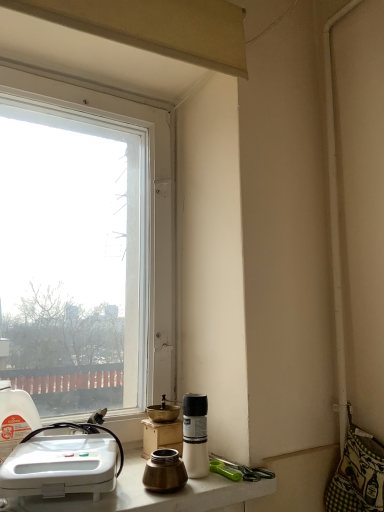
The height and width of the screenshot is (512, 384). What do you see at coordinates (162, 428) in the screenshot?
I see `gold matte grinder at center` at bounding box center [162, 428].

Locate an element on the screen. translucent plastic bottle at left, the 2th bottle from the right is located at coordinates (15, 417).

Find the location of a particular element. The image size is (384, 512). transparent glass window at upper left is located at coordinates (149, 202).

This screenshot has width=384, height=512. I want to click on white plastic sink at lower left, so click(62, 464).

Where is `gold matte grinder at center`? gold matte grinder at center is located at coordinates [162, 428].

There is a white glossy countertop at lower center. Where is `sink above it (from a real-world perspective)`? Image resolution: width=384 pixels, height=512 pixels. sink above it (from a real-world perspective) is located at coordinates (62, 464).

Considering the sizes of white glossy countertop at lower center and white plastic sink at lower left in the image, is white glossy countertop at lower center taller or shorter than white plastic sink at lower left?

Clearly, white glossy countertop at lower center is shorter compared to white plastic sink at lower left.

Considering the relative positions of white glossy countertop at lower center and white plastic sink at lower left in the image provided, is white glossy countertop at lower center behind white plastic sink at lower left?

That is False.

Is white glossy countertop at lower center beside white plastic sink at lower left?

white glossy countertop at lower center and white plastic sink at lower left are clearly separated.

In the image, is translucent plastic bottle at left, marked as the first bottle in a left-to-right arrangement, positioned in front of or behind white glossy countertop at lower center?

Visually, translucent plastic bottle at left, marked as the first bottle in a left-to-right arrangement, is located behind white glossy countertop at lower center.

In the scene shown: Which is closer to the camera, [22,404] or [127,469]?

Point [22,404].

Considering the positions of objects translucent plastic bottle at left, marked as the first bottle in a left-to-right arrangement, and white glossy countertop at lower center in the image provided, who is more to the right, translucent plastic bottle at left, marked as the first bottle in a left-to-right arrangement, or white glossy countertop at lower center?

From the viewer's perspective, white glossy countertop at lower center appears more on the right side.

Locate an element on the screen. This screenshot has width=384, height=512. counter top on the right side of translucent plastic bottle at left, the 2th bottle from the right is located at coordinates (151, 495).

Which object is thinner, white plastic sink at lower left or white matte bottle at lower center, the 1th bottle positioned from the right?

white matte bottle at lower center, the 1th bottle positioned from the right, is thinner.

Is point (107, 469) in front of point (186, 420)?

Yes, it is.

Does white plastic sink at lower left have a smaller size compared to white matte bottle at lower center, the 1th bottle positioned from the right?

Actually, white plastic sink at lower left might be larger than white matte bottle at lower center, the 1th bottle positioned from the right.

This screenshot has width=384, height=512. Find the location of `coffee cup on the right of white glossy countertop at lower center`. coffee cup on the right of white glossy countertop at lower center is located at coordinates (164, 471).

Is brass metallic coffee cup at lower center positioned with its back to white glossy countertop at lower center?

Yes, brass metallic coffee cup at lower center is positioned with its back facing white glossy countertop at lower center.

Would you say white glossy countertop at lower center is part of brass metallic coffee cup at lower center's contents?

No, white glossy countertop at lower center is not inside brass metallic coffee cup at lower center.

Considering the positions of point (67, 94) and point (191, 437), is point (67, 94) closer or farther from the camera than point (191, 437)?

Point (67, 94) is positioned farther from the camera compared to point (191, 437).

From their relative heights in the image, would you say transparent glass window at upper left is taller or shorter than white matte bottle at lower center, positioned as the second bottle in left-to-right order?

Clearly, transparent glass window at upper left is taller compared to white matte bottle at lower center, positioned as the second bottle in left-to-right order.

Is transparent glass window at upper left far away from white matte bottle at lower center, the 1th bottle positioned from the right?

transparent glass window at upper left is actually quite close to white matte bottle at lower center, the 1th bottle positioned from the right.

Considering the relative positions of transparent glass window at upper left and white plastic sink at lower left in the image provided, is transparent glass window at upper left to the left of white plastic sink at lower left from the viewer's perspective?

Correct, you'll find transparent glass window at upper left to the left of white plastic sink at lower left.

Locate an element on the screen. sink on the right of transparent glass window at upper left is located at coordinates (62, 464).

Is transparent glass window at upper left placed right next to white plastic sink at lower left?

No.

Is gold matte grinder at center surrounded by white glossy countertop at lower center?

No, gold matte grinder at center is not surrounded by white glossy countertop at lower center.

Based on the photo, which is more to the left, white glossy countertop at lower center or gold matte grinder at center?

white glossy countertop at lower center is more to the left.

This screenshot has height=512, width=384. What are the coordinates of `counter top on the left of gold matte grinder at center` in the screenshot? It's located at (151, 495).

Who is shorter, white glossy countertop at lower center or gold matte grinder at center?

With less height is white glossy countertop at lower center.

The height and width of the screenshot is (512, 384). In order to click on sink behind the white glossy countertop at lower center in this screenshot , I will do `click(62, 464)`.

Where is `counter top below the translucent plastic bottle at left, the 2th bottle from the right (from the image's perspective)`? The image size is (384, 512). counter top below the translucent plastic bottle at left, the 2th bottle from the right (from the image's perspective) is located at coordinates (151, 495).

From the picture: Looking at the image, which one is located further to brass metallic coffee cup at lower center, translucent plastic bottle at left, marked as the first bottle in a left-to-right arrangement, or white matte bottle at lower center, positioned as the second bottle in left-to-right order?

Among the two, translucent plastic bottle at left, marked as the first bottle in a left-to-right arrangement, is located further to brass metallic coffee cup at lower center.

Looking at the image, which one is located closer to transparent glass window at upper left, white plastic sink at lower left or translucent plastic bottle at left, the 2th bottle from the right?

The object closer to transparent glass window at upper left is white plastic sink at lower left.

Based on the photo, which object lies further to the anchor point transparent glass window at upper left, brass metallic coffee cup at lower center or white matte bottle at lower center, the 1th bottle positioned from the right?

brass metallic coffee cup at lower center lies further to transparent glass window at upper left than the other object.

Looking at this image, when comparing their distances from white plastic sink at lower left, does brass metallic coffee cup at lower center or translucent plastic bottle at left, the 2th bottle from the right, seem closer?

translucent plastic bottle at left, the 2th bottle from the right, is closer to white plastic sink at lower left.

Looking at the image, which one is located further to gold matte grinder at center, white glossy countertop at lower center or brass metallic coffee cup at lower center?

Based on the image, brass metallic coffee cup at lower center appears to be further to gold matte grinder at center.

From the image, which object appears to be farther from white matte bottle at lower center, positioned as the second bottle in left-to-right order, translucent plastic bottle at left, marked as the first bottle in a left-to-right arrangement, or gold matte grinder at center?

translucent plastic bottle at left, marked as the first bottle in a left-to-right arrangement.

Based on their spatial positions, is white glossy countertop at lower center or white matte bottle at lower center, the 1th bottle positioned from the right, closer to gold matte grinder at center?

white matte bottle at lower center, the 1th bottle positioned from the right.

Which object lies further to the anchor point white glossy countertop at lower center, white plastic sink at lower left or white matte bottle at lower center, positioned as the second bottle in left-to-right order?

white matte bottle at lower center, positioned as the second bottle in left-to-right order, is positioned further to the anchor white glossy countertop at lower center.

At what (x,y) coordinates should I click in order to perform the action: click on sink that lies between transparent glass window at upper left and white glossy countertop at lower center from top to bottom. Please return your answer as a coordinate pair (x, y). This screenshot has width=384, height=512. Looking at the image, I should click on (62, 464).

Identify the location of appliance situated between translucent plastic bottle at left, marked as the first bottle in a left-to-right arrangement, and white matte bottle at lower center, positioned as the second bottle in left-to-right order, from left to right. The height and width of the screenshot is (512, 384). (162, 428).

At what (x,y) coordinates should I click in order to perform the action: click on sink located between translucent plastic bottle at left, the 2th bottle from the right, and gold matte grinder at center in the left-right direction. Please return your answer as a coordinate pair (x, y). This screenshot has width=384, height=512. Looking at the image, I should click on (62, 464).

Where is `coffee cup situated between white plastic sink at lower left and white matte bottle at lower center, the 1th bottle positioned from the right, from left to right`? coffee cup situated between white plastic sink at lower left and white matte bottle at lower center, the 1th bottle positioned from the right, from left to right is located at coordinates (164, 471).